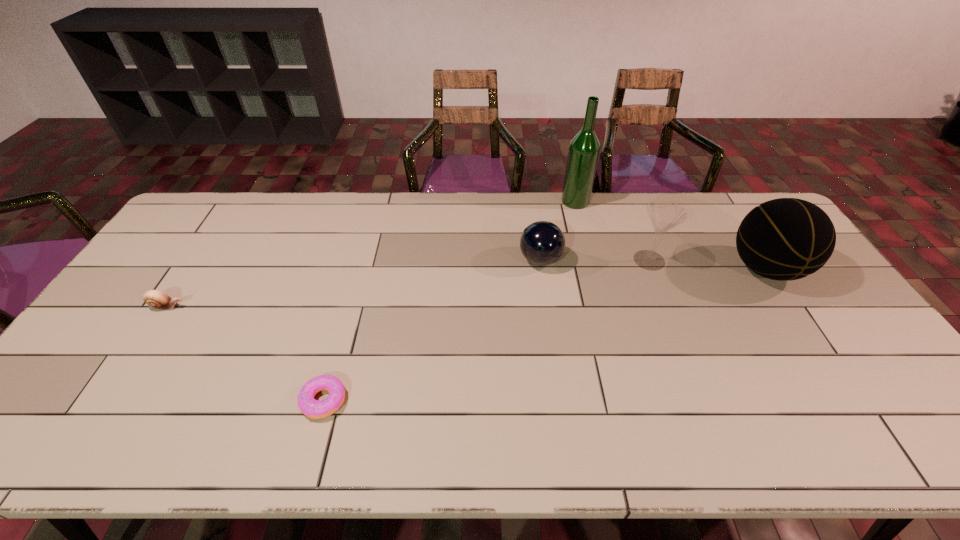
Where is `object present at the far edge`? The image size is (960, 540). object present at the far edge is located at coordinates (584, 149).

At what (x,y) coordinates should I click in order to perform the action: click on object present at the near edge. Please return your answer as a coordinate pair (x, y). The height and width of the screenshot is (540, 960). Looking at the image, I should click on (314, 409).

The height and width of the screenshot is (540, 960). Find the location of `object positioned at the left edge`. object positioned at the left edge is located at coordinates [155, 299].

Where is `object that is at the right edge`? object that is at the right edge is located at coordinates (783, 239).

This screenshot has width=960, height=540. Find the location of `vacant space at the far edge`. vacant space at the far edge is located at coordinates (471, 209).

Locate an element on the screen. The height and width of the screenshot is (540, 960). free location at the near edge is located at coordinates (848, 424).

Where is `vacant space at the right edge`? Image resolution: width=960 pixels, height=540 pixels. vacant space at the right edge is located at coordinates (858, 377).

Identify the location of vacant space in between the flute glass and the escargot. (408, 284).

Where is `vacant area that lies between the fourth shortest object and the nearest object`? Image resolution: width=960 pixels, height=540 pixels. vacant area that lies between the fourth shortest object and the nearest object is located at coordinates (487, 330).

Identify the location of vacant area between the second object from left to right and the alcohol. [449, 301].